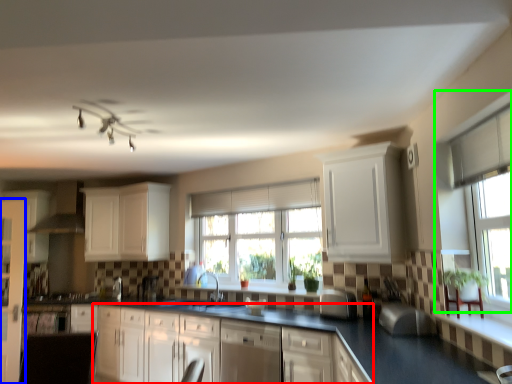
Question: Which object is positioned farthest from cabinetry (highlighted by a red box)? Select from screen door (highlighted by a blue box) and window (highlighted by a green box).

Choices:
 (A) screen door
 (B) window

Answer: (B)